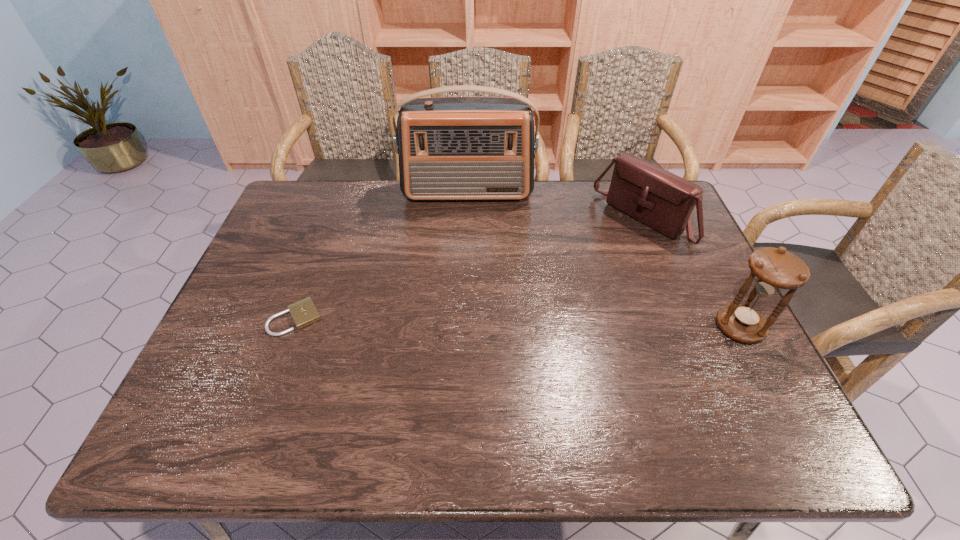
Find the location of a particular element. The width and height of the screenshot is (960, 540). free space on the desktop that is between the shortest object and the third shortest object and is positioned on the front-facing side of the radio receiver is located at coordinates (465, 322).

Image resolution: width=960 pixels, height=540 pixels. I want to click on vacant spot on the desktop that is between the shortest object and the second tallest object and is positioned on the front flap of the shoulder bag, so click(x=512, y=322).